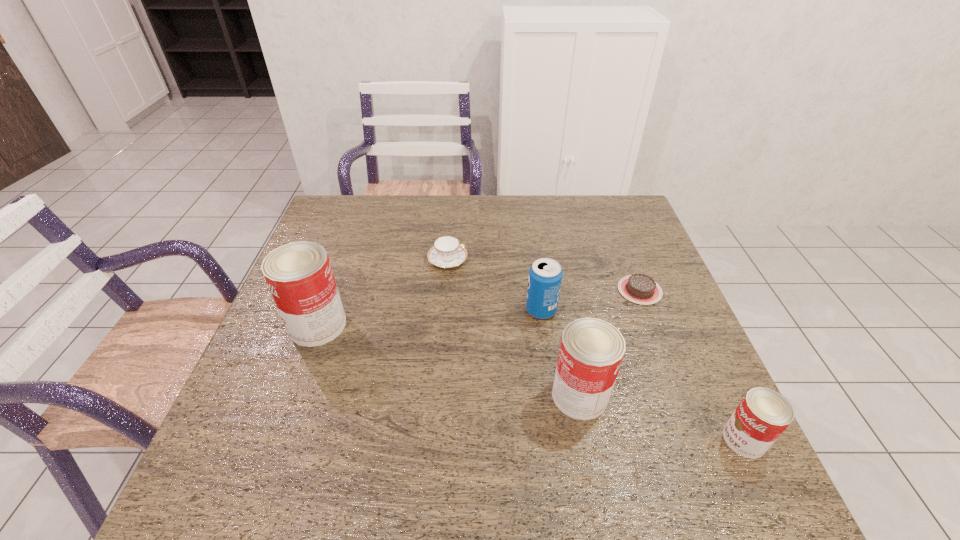
What are the coordinates of `free location that satisfies the following two spatial constraints: 1. on the back side of the chocolate cake; 2. on the side with the handle of the teacup` in the screenshot? It's located at (628, 260).

Where is `free space that satisfies the following two spatial constraints: 1. on the front side of the chocolate cake; 2. on the front label of the leftmost can`? free space that satisfies the following two spatial constraints: 1. on the front side of the chocolate cake; 2. on the front label of the leftmost can is located at coordinates (653, 325).

Locate an element on the screen. vacant space that satisfies the following two spatial constraints: 1. on the back side of the chocolate cake; 2. on the right side of the fourth shortest object is located at coordinates (539, 291).

I want to click on vacant point that satisfies the following two spatial constraints: 1. on the side with the handle of the fifth object from right to left; 2. on the left side of the shortest object, so click(445, 291).